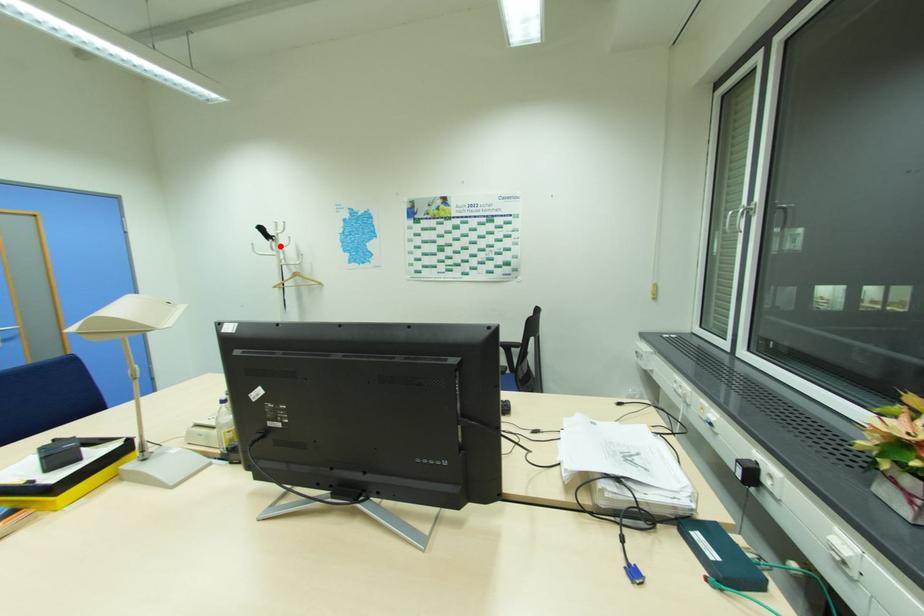
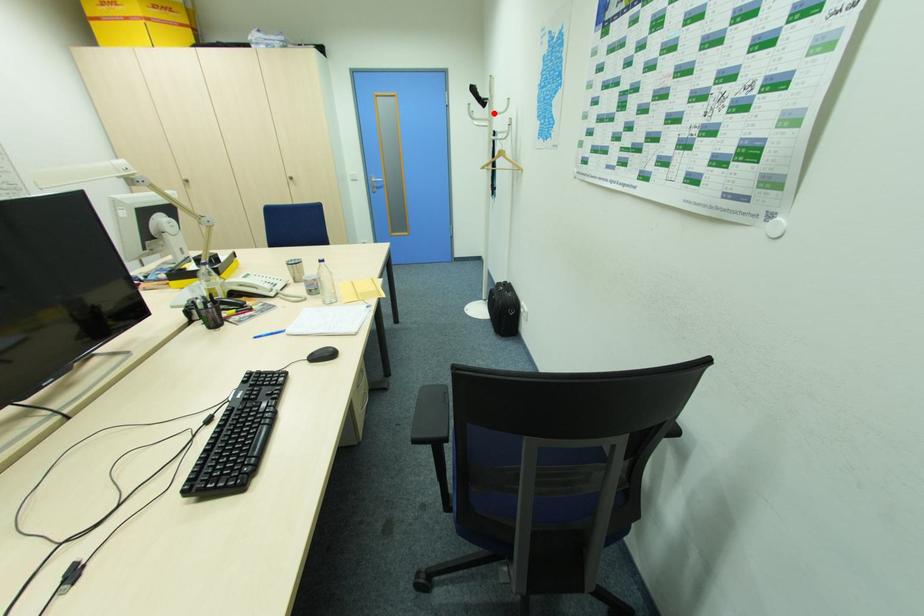
I am providing you with two images of the same scene from different viewpoints. A red point is marked on the first image and another point is marked on the second image. Is the marked point in image1 the same physical position as the marked point in image2?

Yes